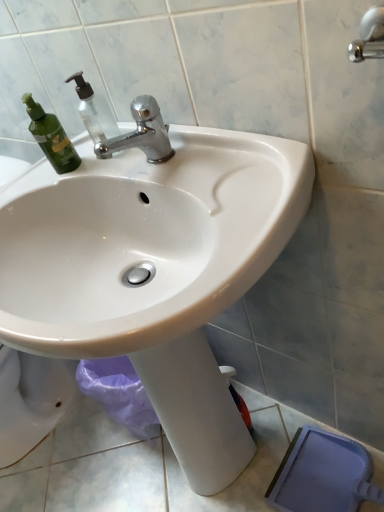
The height and width of the screenshot is (512, 384). Identify the location of vacant space situated on the left part of polished chrome faucet at upper center. (89, 169).